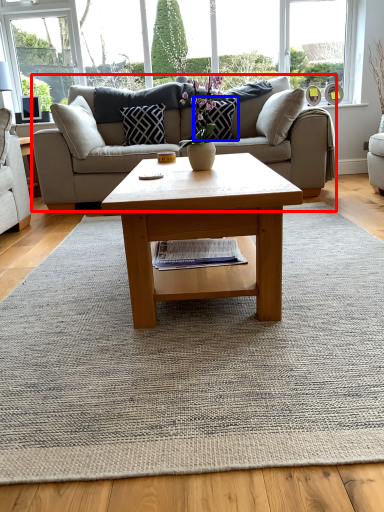
Question: Among these objects, which one is farthest to the camera, studio couch (highlighted by a red box) or pillow (highlighted by a blue box)?

Choices:
 (A) studio couch
 (B) pillow

Answer: (B)